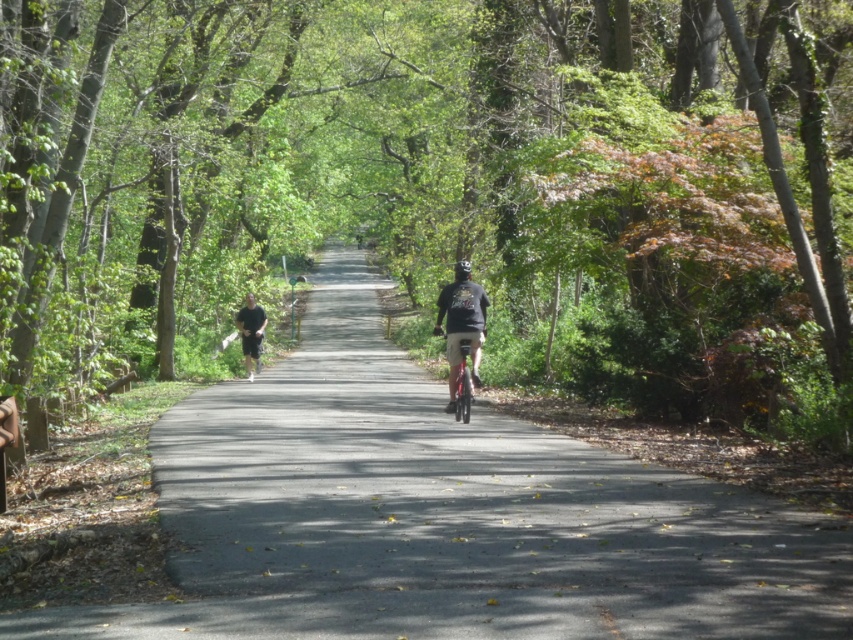
Does asphalt road at center appear on the right side of black matte shorts at left?

Correct, you'll find asphalt road at center to the right of black matte shorts at left.

Does asphalt road at center have a greater height compared to black matte shorts at left?

No.

Describe the element at coordinates (444, 515) in the screenshot. I see `asphalt road at center` at that location.

Identify the location of asphalt road at center. (444, 515).

Is green leafy tree at center to the left of dark gray fabric shirt at center from the viewer's perspective?

Yes, green leafy tree at center is to the left of dark gray fabric shirt at center.

Who is taller, green leafy tree at center or dark gray fabric shirt at center?

green leafy tree at center

This screenshot has height=640, width=853. Describe the element at coordinates (445, 186) in the screenshot. I see `green leafy tree at center` at that location.

Image resolution: width=853 pixels, height=640 pixels. Identify the location of green leafy tree at center. (445, 186).

Between dark gray fabric shirt at center and shiny metallic bicycle at center, which one appears on the left side from the viewer's perspective?

shiny metallic bicycle at center

Who is positioned more to the right, dark gray fabric shirt at center or shiny metallic bicycle at center?

From the viewer's perspective, dark gray fabric shirt at center appears more on the right side.

Which is behind, point (471, 372) or point (477, 349)?

Positioned behind is point (477, 349).

At what (x,y) coordinates should I click in order to perform the action: click on dark gray fabric shirt at center. Please return your answer as a coordinate pair (x, y). Looking at the image, I should click on (462, 323).